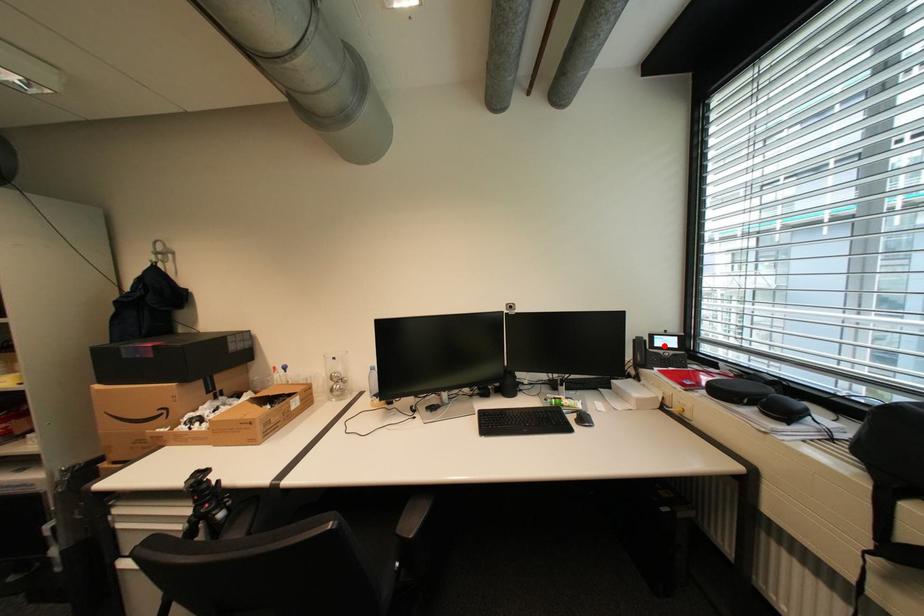
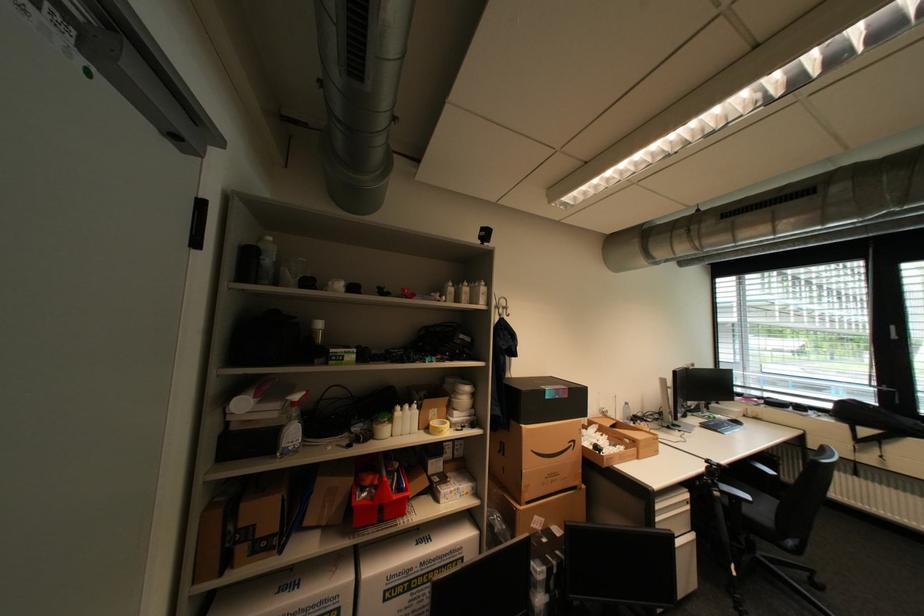
Question: I am providing you with two images of the same scene from different viewpoints. A red point is marked on the first image. At the location where the point appears in image 1, is it still visible in image 2?

Choices:
 (A) Yes
 (B) No

Answer: (B)